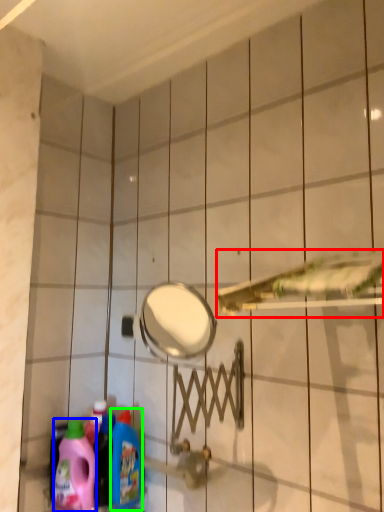
Question: Based on their relative distances, which object is nearer to shower (highlighted by a red box)? Choose from cleaning product (highlighted by a blue box) and cleaning product (highlighted by a green box).

Choices:
 (A) cleaning product
 (B) cleaning product

Answer: (B)